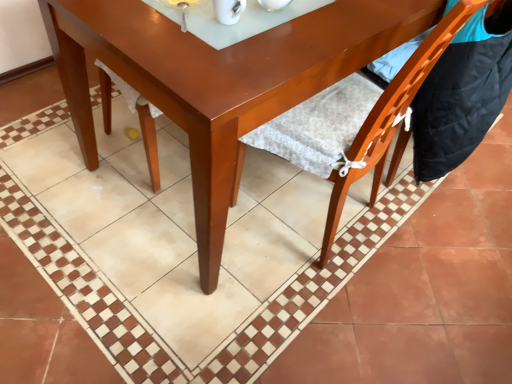
Find the location of a particular element. free spot to the left of wooden chair at lower right, arranged as the first chair when viewed from the left is located at coordinates (234, 224).